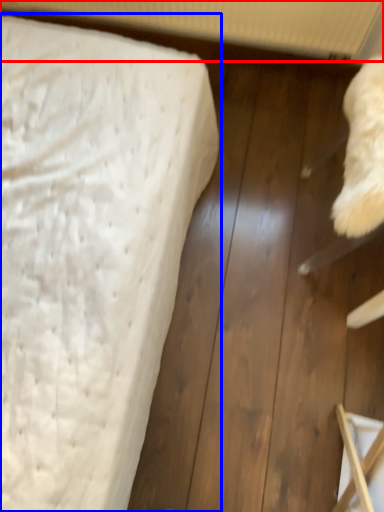
Question: Which of the following is the closest to the observer, radiator (highlighted by a red box) or bed (highlighted by a blue box)?

Choices:
 (A) radiator
 (B) bed

Answer: (B)